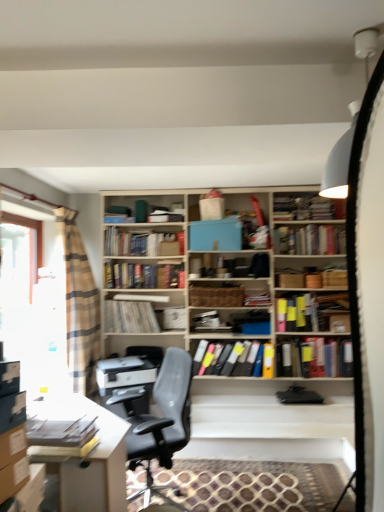
Question: Is matte white desk at lower left to the left or to the right of beige plaid curtain at left in the image?

Choices:
 (A) left
 (B) right

Answer: (B)

Question: From a real-world perspective, is matte white desk at lower left positioned above or below beige plaid curtain at left?

Choices:
 (A) above
 (B) below

Answer: (B)

Question: Estimate the real-world distances between objects in this image. Which object is farther from the beige plaid curtain at left?

Choices:
 (A) multicolored plastic folders at center, which is the 3th book from front to back
 (B) hardcover books at upper right, the fifth book positioned from the back
 (C) matte gray book at lower left, the first book when ordered from front to back
 (D) black leather chair at center
 (E) matte white desk at lower left

Answer: (B)

Question: Which is farther from the hardcover book at center, the 7th book viewed from the front?

Choices:
 (A) wooden bookshelf at center, which is the fifth book from front to back
 (B) white paper at center, the eighth book positioned from the front
 (C) beige plaid curtain at left
 (D) multicolored file folders at center, which ranks as the 2th book in front-to-back order
 (E) brown woven basket at center

Answer: (D)